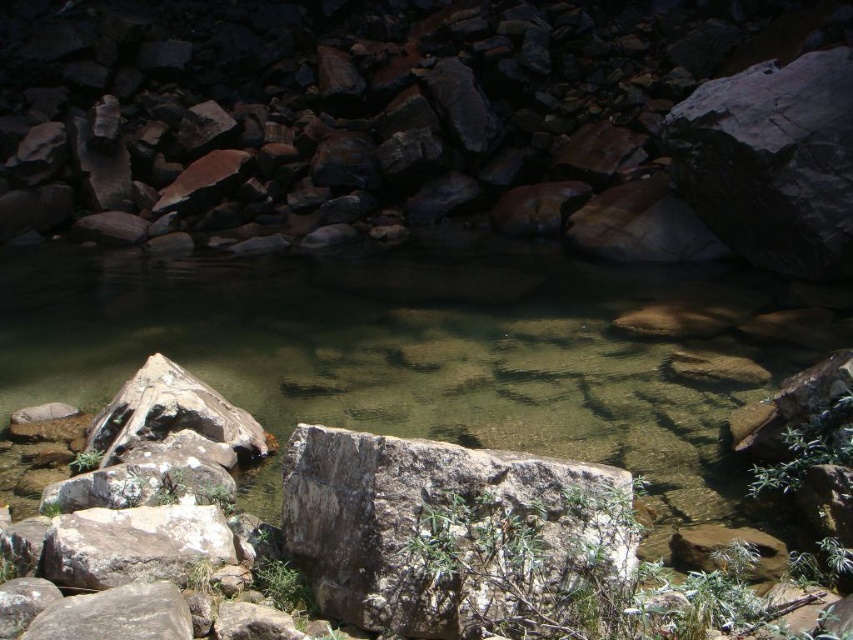
You are standing at the origin point of the image, which is the bottom left corner. You want to cross the clear stone stream at center. In which direction should you move to reach it?

The clear stone stream at center is located at point 0.553 on the x axis and 0.479 on the y axis. Since you are at the origin point, which is the bottom left corner, you should move northeast to reach it.

You are standing at the point with coordinates point (318, 598) and want to reach the point with coordinates point (561, 445). Which direction should you move to get closer to your destination?

You should move backward because point (561, 445) is behind point (318, 598).